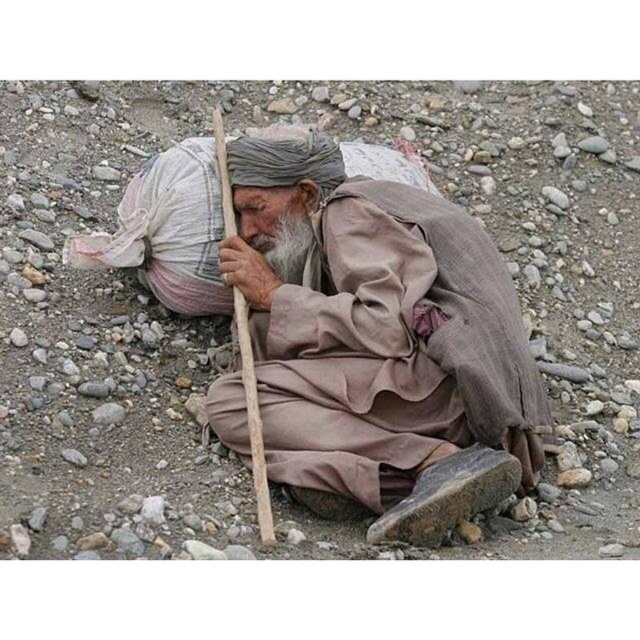
Question: Among these objects, which one is nearest to the camera?

Choices:
 (A) brown fabric at center
 (B) gray/bearded at center

Answer: (A)

Question: Which point appears farthest from the camera in this image?

Choices:
 (A) (252, 240)
 (B) (260, 148)

Answer: (A)

Question: Is brown fabric at center to the right of gray/bearded at center from the viewer's perspective?

Choices:
 (A) no
 (B) yes

Answer: (B)

Question: Does brown fabric at center have a larger size compared to gray/bearded at center?

Choices:
 (A) no
 (B) yes

Answer: (B)

Question: Which point is farther to the camera?

Choices:
 (A) brown fabric at center
 (B) gray/bearded at center

Answer: (B)

Question: Is brown fabric at center to the left of gray/bearded at center from the viewer's perspective?

Choices:
 (A) yes
 (B) no

Answer: (B)